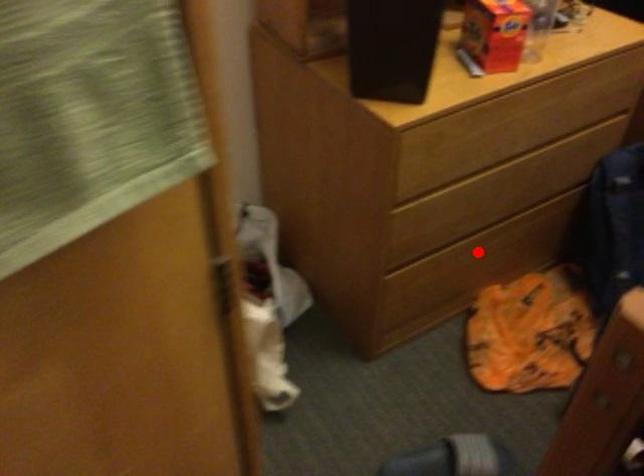
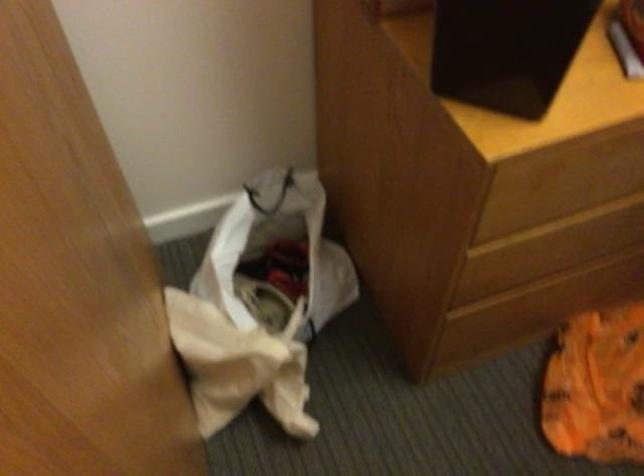
Locate, in the second image, the point that corresponds to the highlighted location in the first image.

(583, 283)